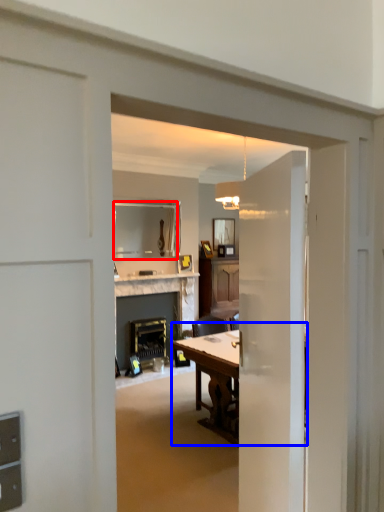
Question: Which object is closer to the camera taking this photo, mirror (highlighted by a red box) or table (highlighted by a blue box)?

Choices:
 (A) mirror
 (B) table

Answer: (B)